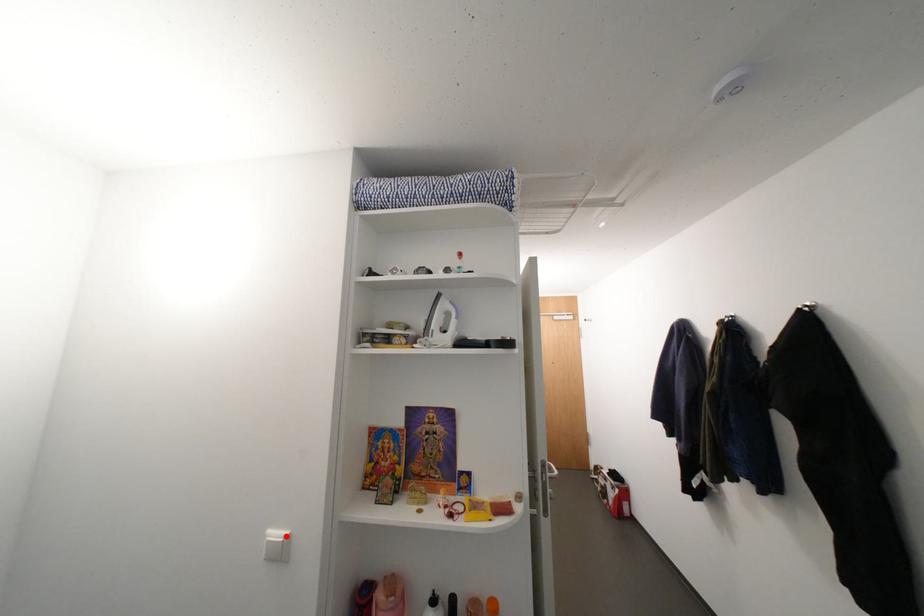
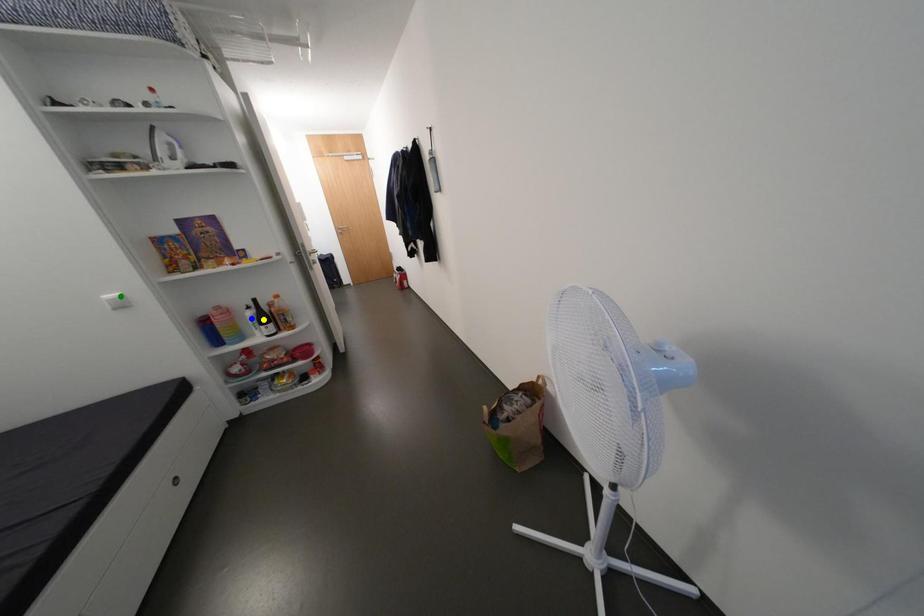
Question: I am providing you with two images of the same scene from different viewpoints. A red point is marked on the first image. You are given multiple points on the second image. In image 2, which mark is for the same physical point as the one in image 1?

Choices:
 (A) yellow point
 (B) green point
 (C) blue point

Answer: (B)